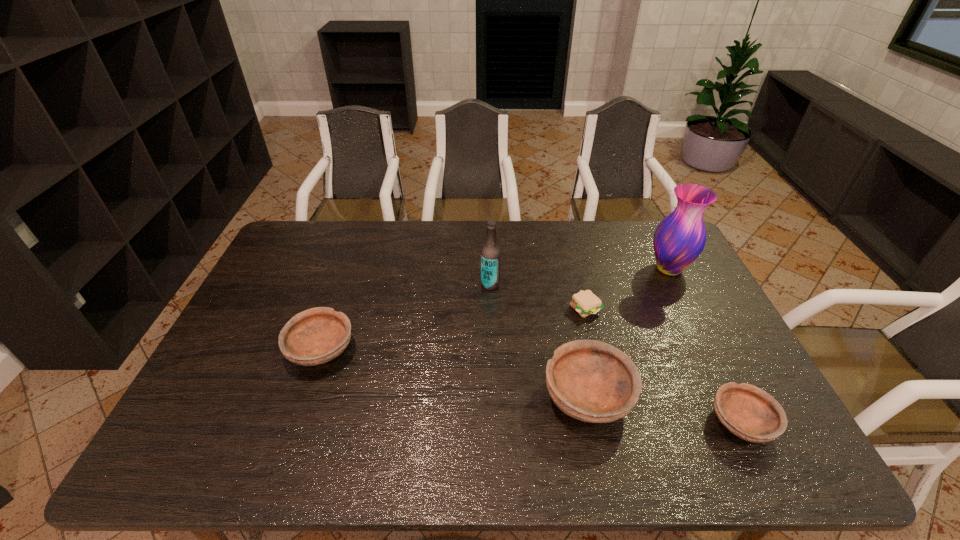
At what (x,y) coordinates should I click in order to perform the action: click on the tallest object. Please return your answer as a coordinate pair (x, y). Looking at the image, I should click on (679, 239).

The image size is (960, 540). In order to click on vacant space located on the left of the second shortest bowl in this screenshot , I will do click(x=252, y=350).

Find the location of `free point located 0.250m on the back of the fourth shortest object`. free point located 0.250m on the back of the fourth shortest object is located at coordinates click(566, 296).

At what (x,y) coordinates should I click in order to perform the action: click on free spot located 0.100m on the back of the rightmost bowl. Please return your answer as a coordinate pair (x, y). This screenshot has width=960, height=540. Looking at the image, I should click on [712, 364].

Where is `blank area located on the left of the shortest object`? blank area located on the left of the shortest object is located at coordinates (550, 308).

I want to click on free region located on the side of the fifth shortest object with the label, so click(388, 285).

At what (x,y) coordinates should I click in order to perform the action: click on free space located 0.080m on the side of the fifth shortest object with the label. Please return your answer as a coordinate pair (x, y). Looking at the image, I should click on (456, 285).

Where is `free space located on the side of the fifth shortest object with the label`? This screenshot has height=540, width=960. free space located on the side of the fifth shortest object with the label is located at coordinates (360, 285).

This screenshot has width=960, height=540. In order to click on free location located on the left of the tallest object in this screenshot , I will do `click(584, 269)`.

Find the location of a particular element. object that is positioned at the far edge is located at coordinates (679, 239).